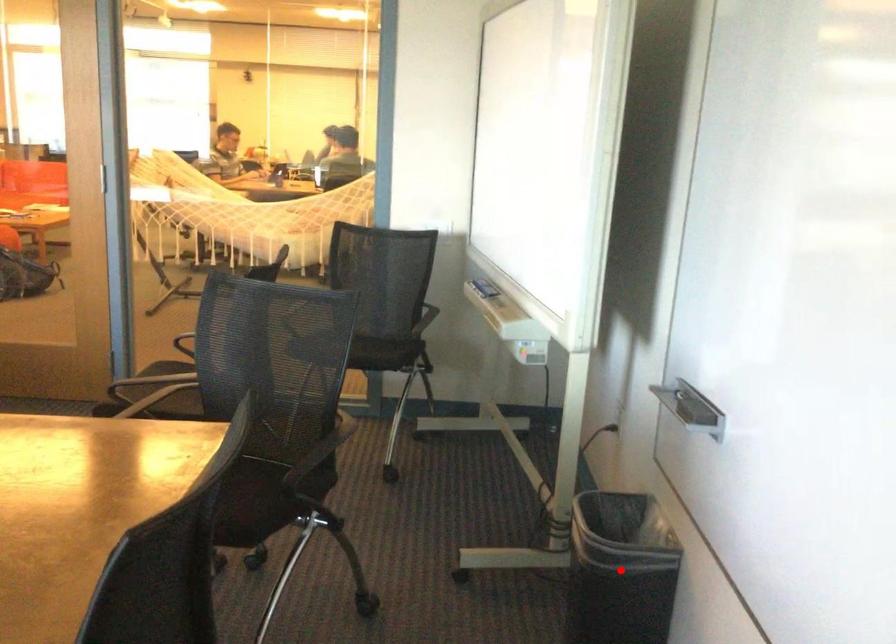
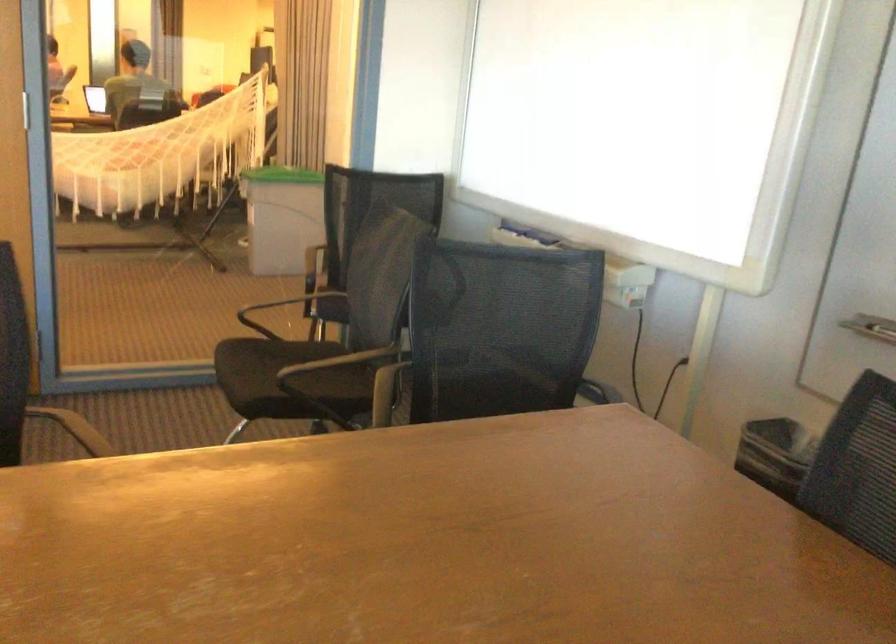
Question: I am providing you with two images of the same scene from different viewpoints. A red point is marked on the first image. Is the red point's position out of view in image 2?

Choices:
 (A) Yes
 (B) No

Answer: (A)